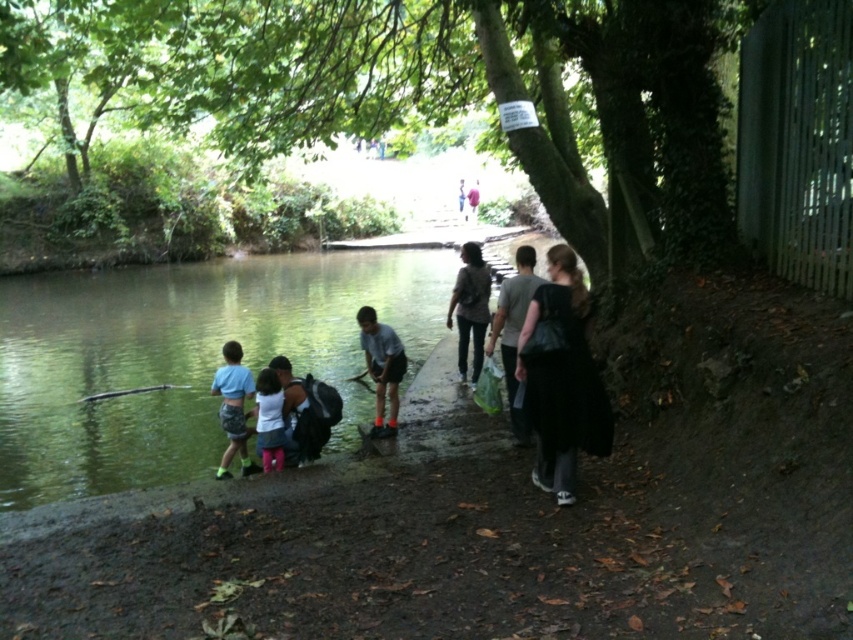
Can you confirm if green smooth water at lower left is wider than pink fabric pants at lower center?

Correct, the width of green smooth water at lower left exceeds that of pink fabric pants at lower center.

This screenshot has width=853, height=640. Identify the location of green smooth water at lower left. [184, 356].

Is light blue fabric shirt at center closer to the viewer compared to camouflage shorts at lower left?

No, light blue fabric shirt at center is further to the viewer.

Can you confirm if light blue fabric shirt at center is positioned to the left of camouflage shorts at lower left?

In fact, light blue fabric shirt at center is to the right of camouflage shorts at lower left.

Locate an element on the screen. The height and width of the screenshot is (640, 853). light blue fabric shirt at center is located at coordinates (381, 365).

Is green smooth water at lower left bigger than light blue fabric shirt at center?

Indeed, green smooth water at lower left has a larger size compared to light blue fabric shirt at center.

Measure the distance between green smooth water at lower left and light blue fabric shirt at center.

They are 9.32 meters apart.

Who is more forward, (149,312) or (393,362)?

Point (393,362) is in front.

Where is `green smooth water at lower left`? Image resolution: width=853 pixels, height=640 pixels. green smooth water at lower left is located at coordinates (184, 356).